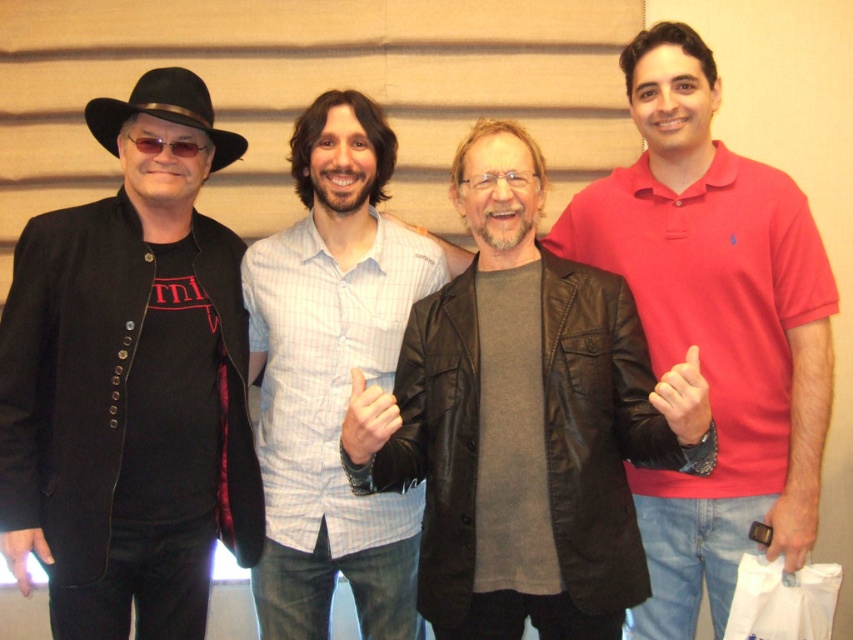
Is black leather jacket at left positioned at the back of black felt fedora at upper left?

That is False.

Does point (28, 227) come behind point (212, 113)?

No, it is not.

Locate an element on the screen. The width and height of the screenshot is (853, 640). black leather jacket at left is located at coordinates (131, 381).

Is red cotton polo shirt at right to the right of light blue striped shirt at center from the viewer's perspective?

Yes, red cotton polo shirt at right is to the right of light blue striped shirt at center.

Is red cotton polo shirt at right further to the viewer compared to light blue striped shirt at center?

No, it is not.

Who is more forward, [692,184] or [306,262]?

Positioned in front is point [692,184].

The image size is (853, 640). Find the location of `red cotton polo shirt at right`. red cotton polo shirt at right is located at coordinates (714, 328).

Is black leather jacket at left closer to camera compared to red cotton polo shirt at right?

That is True.

Can you confirm if black leather jacket at left is positioned to the left of red cotton polo shirt at right?

Yes, black leather jacket at left is to the left of red cotton polo shirt at right.

Based on the photo, who is more forward, (235,316) or (653,536)?

Point (235,316) is more forward.

Find the location of a particular element. black leather jacket at left is located at coordinates (131, 381).